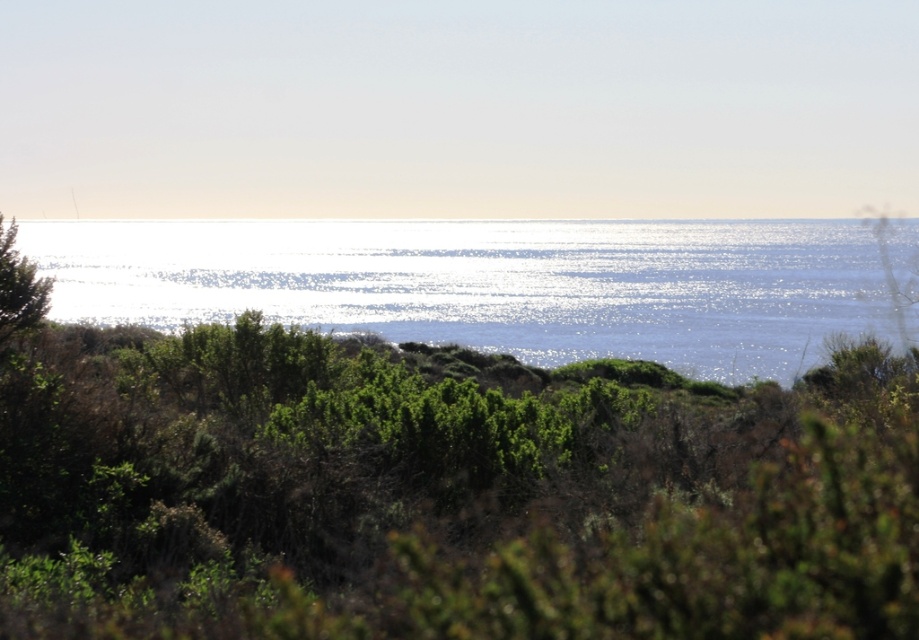
You are an environmental scientist studying the coastal area. You observe the green leafy bush at upper center and the glistening blue water at center. Which object occupies a larger area in the scene?

The glistening blue water at center occupies a larger area than the green leafy bush at upper center because the glistening blue water at center is bigger.

From the picture: You are standing at the center of the coastal landscape and want to reach the glistening blue water at center. According to the coordinates provided, in which direction should you walk to reach it?

The glistening blue water at center is located at coordinates point (491, 284), so you should walk towards the center to reach it.